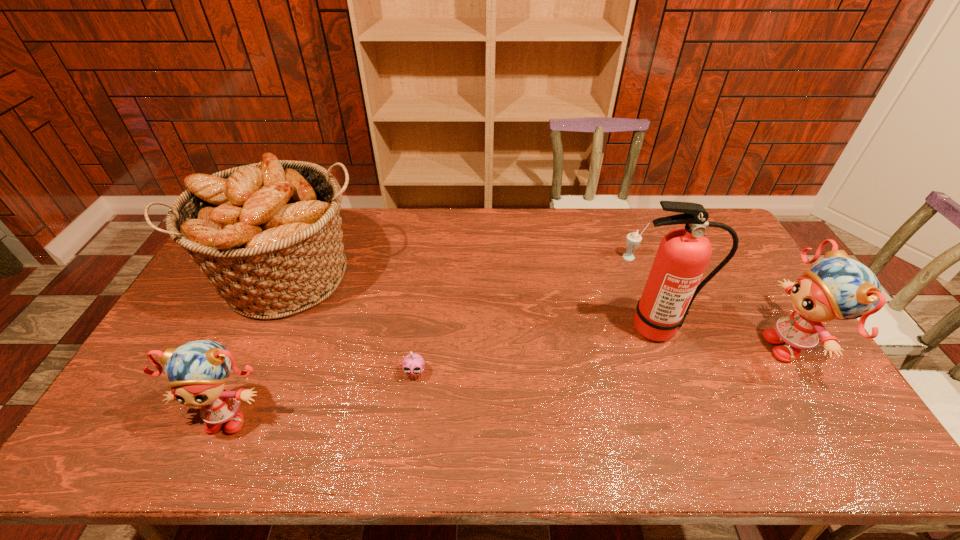
Locate an element on the screen. The width and height of the screenshot is (960, 540). empty space that is in between the second shortest object and the cupcake is located at coordinates (523, 315).

At what (x,y) coordinates should I click in order to perform the action: click on unoccupied area between the shortest object and the right doll. Please return your answer as a coordinate pair (x, y). This screenshot has width=960, height=540. Looking at the image, I should click on (x=604, y=360).

I want to click on free space between the left doll and the fire extinguisher, so click(444, 370).

The height and width of the screenshot is (540, 960). I want to click on free space between the basket and the left doll, so click(261, 345).

Where is `vacant point located between the shorter doll and the tallest object`? This screenshot has width=960, height=540. vacant point located between the shorter doll and the tallest object is located at coordinates (444, 370).

This screenshot has width=960, height=540. I want to click on free space between the shortest object and the basket, so click(353, 325).

This screenshot has width=960, height=540. I want to click on vacant point located between the tallest object and the right doll, so pos(726,337).

Identify which object is located as the fourth nearest to the cupcake. Please provide its 2D coordinates. Your answer should be formatted as a tuple, i.e. [(x, y)], where the tuple contains the x and y coordinates of a point satisfying the conditions above.

[(633, 239)]

Locate which object ranks second in proximity to the left doll. Please provide its 2D coordinates. Your answer should be formatted as a tuple, i.e. [(x, y)], where the tuple contains the x and y coordinates of a point satisfying the conditions above.

[(413, 364)]

The height and width of the screenshot is (540, 960). I want to click on vacant space that satisfies the following two spatial constraints: 1. on the face of the fourth shortest object; 2. on the face of the shorter doll, so 835,412.